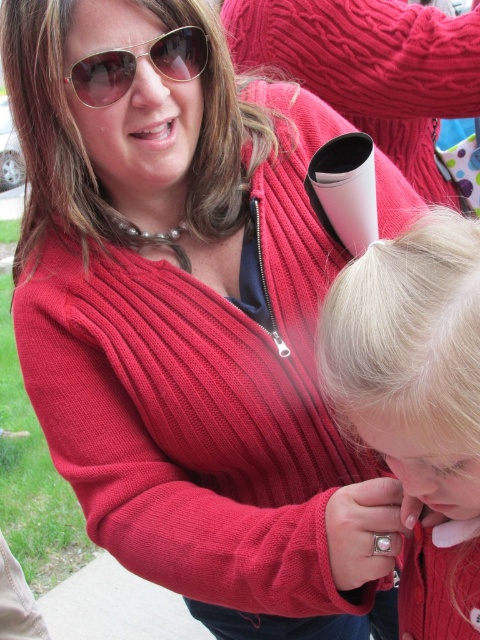
Can you confirm if blonde hair at upper center is bigger than metallic reflective sunglasses at upper left?

Yes.

Can you confirm if blonde hair at upper center is positioned below metallic reflective sunglasses at upper left?

Yes, blonde hair at upper center is below metallic reflective sunglasses at upper left.

Who is more forward, (28, 198) or (78, 65)?

Point (78, 65) is more forward.

The image size is (480, 640). Find the location of `blonde hair at upper center`. blonde hair at upper center is located at coordinates (55, 136).

Based on the photo, does blonde hair at center come behind blonde hair at upper center?

That is False.

The height and width of the screenshot is (640, 480). I want to click on blonde hair at center, so click(x=418, y=401).

Who is shorter, blonde hair at center or metallic reflective sunglasses at upper left?

metallic reflective sunglasses at upper left is shorter.

From the picture: Is blonde hair at center thinner than metallic reflective sunglasses at upper left?

Yes, blonde hair at center is thinner than metallic reflective sunglasses at upper left.

At what (x,y) coordinates should I click in order to perform the action: click on blonde hair at center. Please return your answer as a coordinate pair (x, y). This screenshot has width=480, height=640. Looking at the image, I should click on (418, 401).